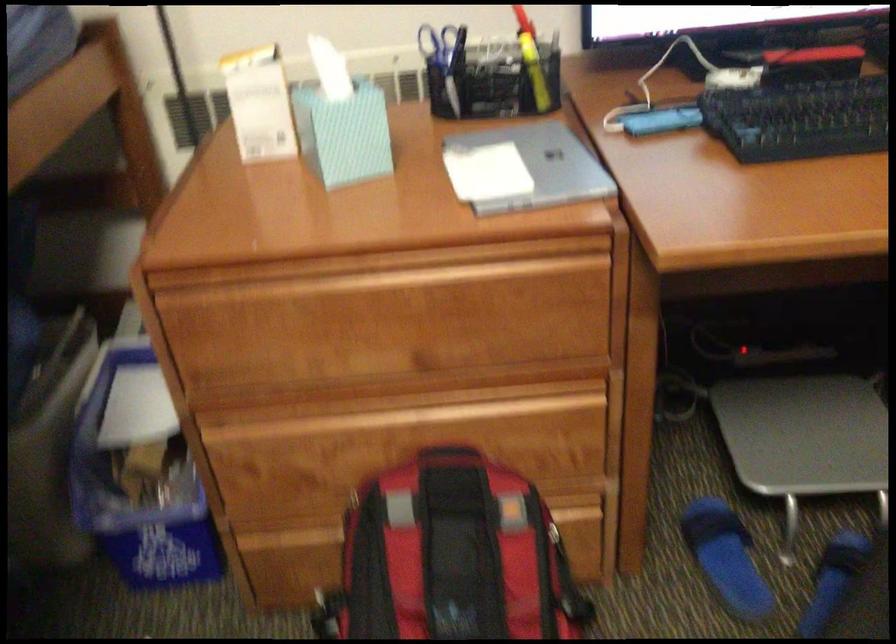
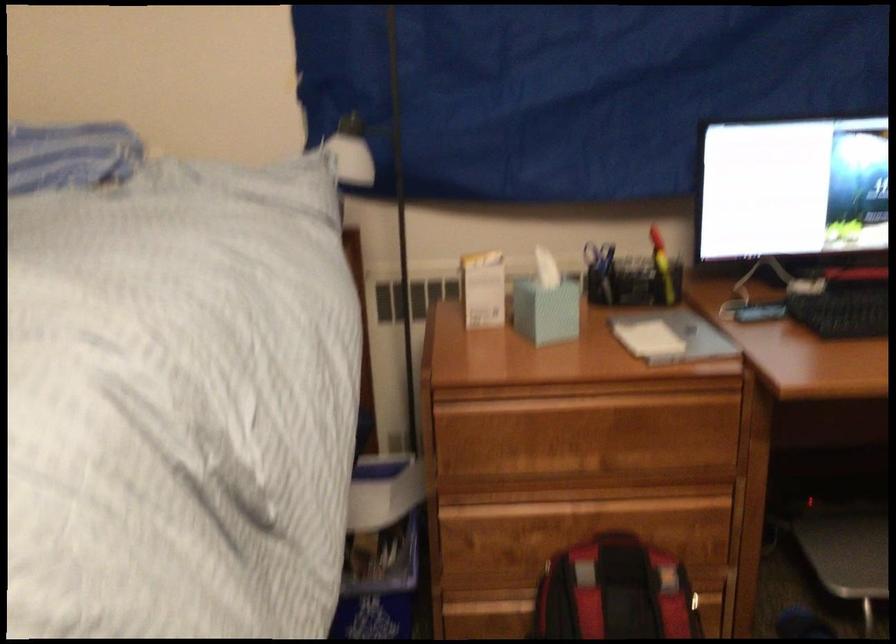
Where in the second image is the point corresponding to pixel 449 529 from the first image?

(615, 592)